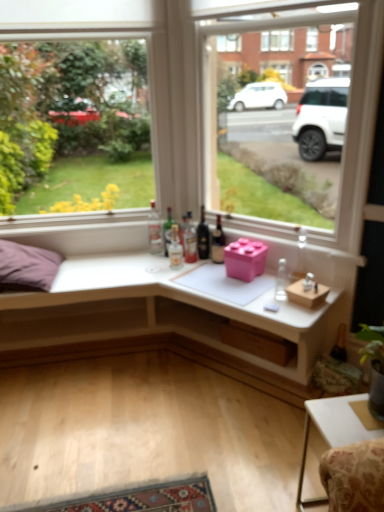
Where is `free space in front of translucent glass bottle at center, marked as the 3th bottle in a left-to-right arrangement`? The width and height of the screenshot is (384, 512). free space in front of translucent glass bottle at center, marked as the 3th bottle in a left-to-right arrangement is located at coordinates click(174, 279).